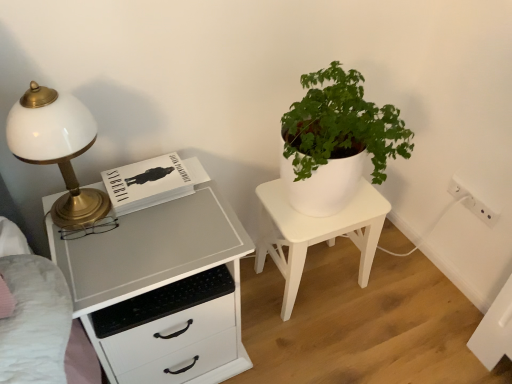
This screenshot has width=512, height=384. I want to click on free spot below white matte/porcelain nightstand at center (from a real-world perspective), so click(318, 274).